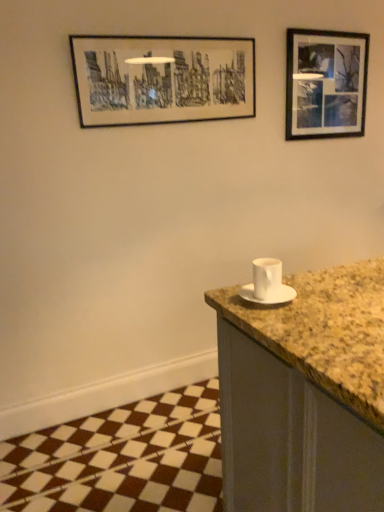
Question: Is black matte picture frame at upper right, the first picture frame viewed from the back, taller or shorter than white matte saucer at right?

Choices:
 (A) short
 (B) tall

Answer: (B)

Question: Would you say black matte picture frame at upper right, arranged as the 2th picture frame when viewed from the front, is to the left or to the right of white matte saucer at right in the picture?

Choices:
 (A) right
 (B) left

Answer: (A)

Question: Which is nearer to the black matte picture frame at upper center, acting as the 2th picture frame starting from the back?

Choices:
 (A) white matte saucer at right
 (B) white ceramic cup at right
 (C) black matte picture frame at upper right, marked as the first picture frame in a right-to-left arrangement

Answer: (C)

Question: Which object is positioned farthest from the black matte picture frame at upper right, arranged as the 2th picture frame when viewed from the front?

Choices:
 (A) black matte picture frame at upper center, which is the 1th picture frame from front to back
 (B) white ceramic cup at right
 (C) white matte saucer at right

Answer: (C)